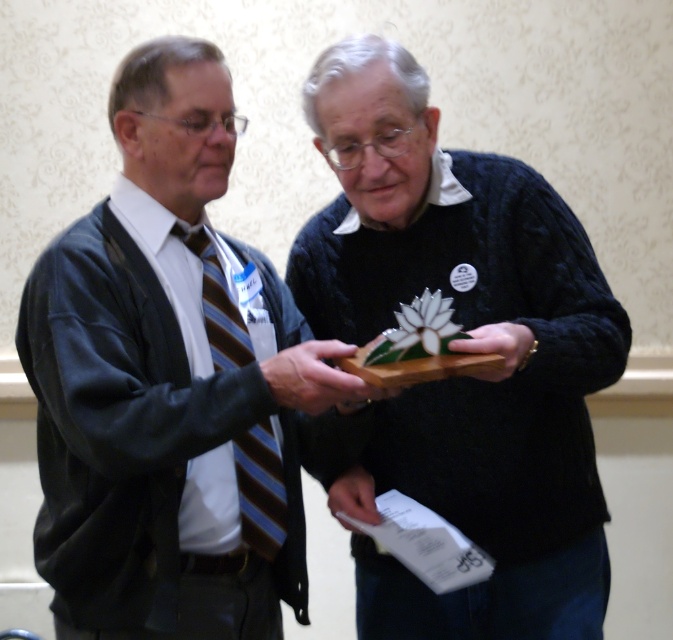
Question: Which point is closer to the camera taking this photo?

Choices:
 (A) (503, 344)
 (B) (260, 458)
 (C) (548, 604)

Answer: (A)

Question: Is brown striped tie at left below matte brown leather at center?

Choices:
 (A) no
 (B) yes

Answer: (B)

Question: Does cable-knit sweater at center lie behind matte brown leather at center?

Choices:
 (A) yes
 (B) no

Answer: (B)

Question: Does cable-knit sweater at center have a larger size compared to white paper at center?

Choices:
 (A) no
 (B) yes

Answer: (B)

Question: Among these objects, which one is farthest from the camera?

Choices:
 (A) gold metallic watch at center
 (B) cable-knit sweater at center
 (C) brown striped tie at left

Answer: (C)

Question: Which object is the farthest from the white paper at center?

Choices:
 (A) matte black jacket at left
 (B) cable-knit sweater at center
 (C) gold metallic watch at center
 (D) brown striped tie at left

Answer: (A)